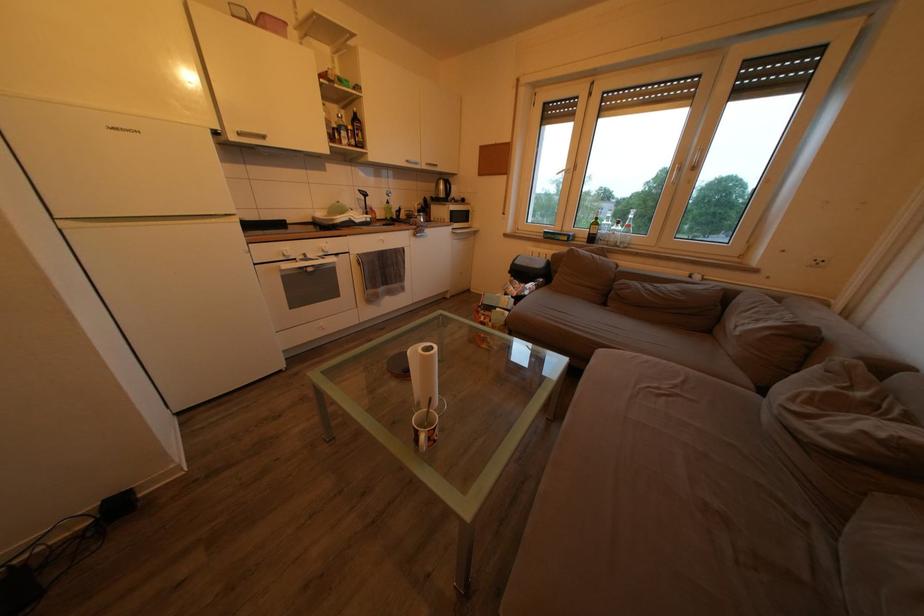
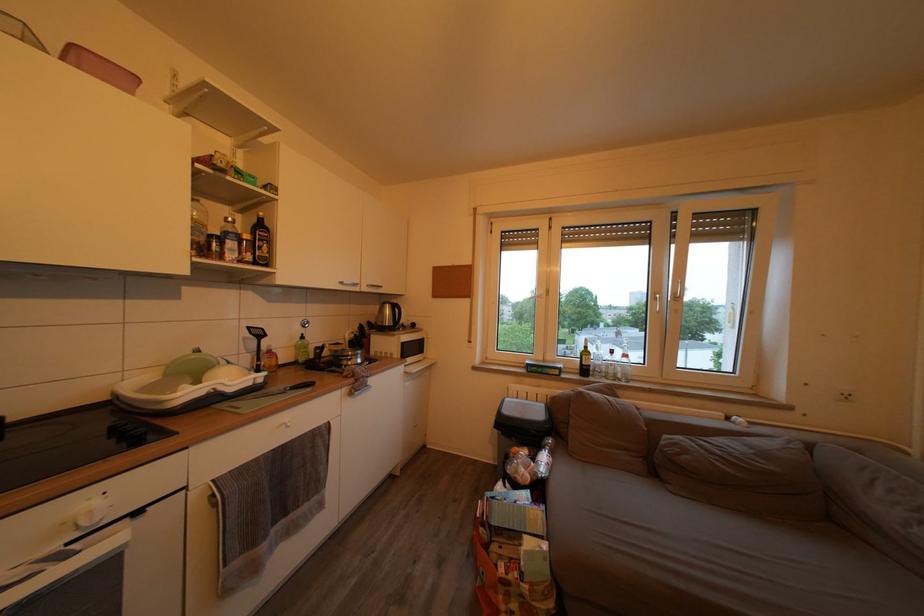
Locate, in the second image, the point that corresponds to the point at 335,128 in the first image.

(205, 230)